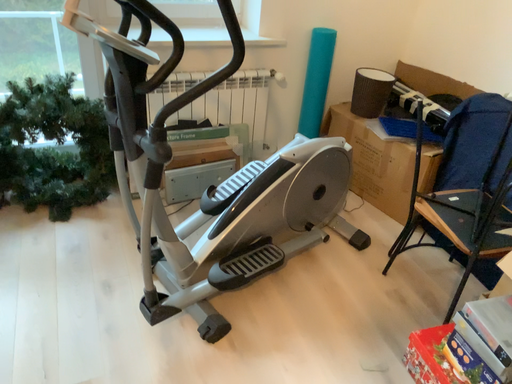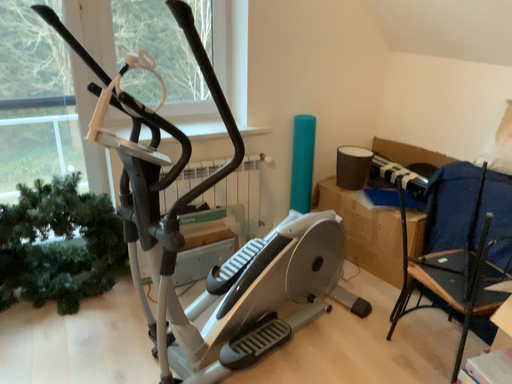
Question: Which way did the camera rotate in the video?

Choices:
 (A) rotated downward
 (B) rotated upward

Answer: (B)